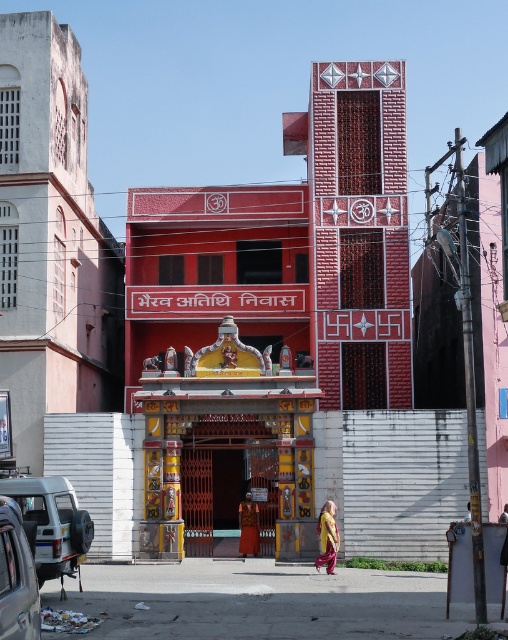
Does yellow satin robe at center have a greater width compared to orange velvet robe at center?

Correct, the width of yellow satin robe at center exceeds that of orange velvet robe at center.

Does yellow satin robe at center appear under orange velvet robe at center?

No.

The width and height of the screenshot is (508, 640). Describe the element at coordinates (328, 538) in the screenshot. I see `yellow satin robe at center` at that location.

At what (x,y) coordinates should I click in order to perform the action: click on yellow satin robe at center. Please return your answer as a coordinate pair (x, y). This screenshot has height=640, width=508. Looking at the image, I should click on click(328, 538).

Does wooden gate at center have a greater width compared to silver metallic van at lower left?

Yes, wooden gate at center is wider than silver metallic van at lower left.

Is wooden gate at center above silver metallic van at lower left?

Yes, wooden gate at center is above silver metallic van at lower left.

Is point (188, 476) less distant than point (54, 545)?

No.

This screenshot has width=508, height=640. Identify the location of wooden gate at center. (227, 477).

Looking at this image, is metallic silver car at lower left taller than orange velvet robe at center?

No.

Between metallic silver car at lower left and orange velvet robe at center, which one appears on the right side from the viewer's perspective?

orange velvet robe at center is more to the right.

Who is more distant from viewer, (35, 572) or (250, 508)?

Positioned behind is point (250, 508).

Find the location of a particular element. The width and height of the screenshot is (508, 640). metallic silver car at lower left is located at coordinates (16, 577).